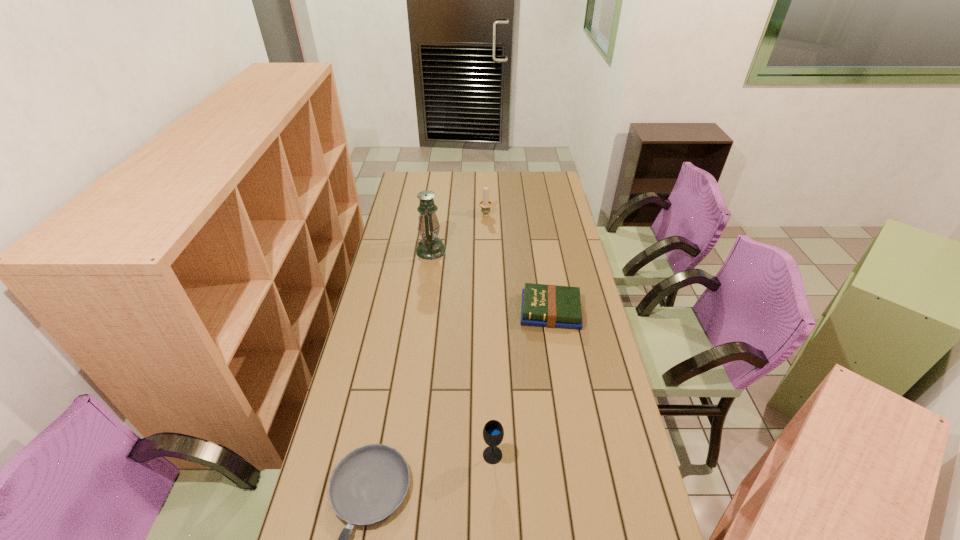
The width and height of the screenshot is (960, 540). I want to click on the tallest object, so click(430, 247).

You are a GUI agent. You are given a task and a screenshot of the screen. Output one action in this format:
    pyautogui.click(x=<x>, y=<y>)
    Task: Click on the fourth nearest object
    This screenshot has width=960, height=540.
    Given the screenshot: What is the action you would take?
    pyautogui.click(x=430, y=247)

Locate an element on the screen. This screenshot has width=960, height=540. the farthest object is located at coordinates (485, 204).

This screenshot has width=960, height=540. Find the location of `wineglass`. wineglass is located at coordinates (493, 432).

The image size is (960, 540). In order to click on the second shortest object in this screenshot , I will do `click(552, 306)`.

Image resolution: width=960 pixels, height=540 pixels. Identify the location of the rightmost object. (552, 306).

At what (x,y) coordinates should I click in order to perform the action: click on free space located 0.100m on the front of the second farthest object. Please return your answer as a coordinate pair (x, y). The width and height of the screenshot is (960, 540). Looking at the image, I should click on (427, 276).

Where is `free space located 0.090m on the handle side of the farthest object`? This screenshot has width=960, height=540. free space located 0.090m on the handle side of the farthest object is located at coordinates (486, 200).

Image resolution: width=960 pixels, height=540 pixels. Identify the location of free location located 0.170m on the handle side of the farthest object. (486, 192).

This screenshot has height=540, width=960. Identify the location of blank area located 0.350m on the handle side of the farthest object. (485, 176).